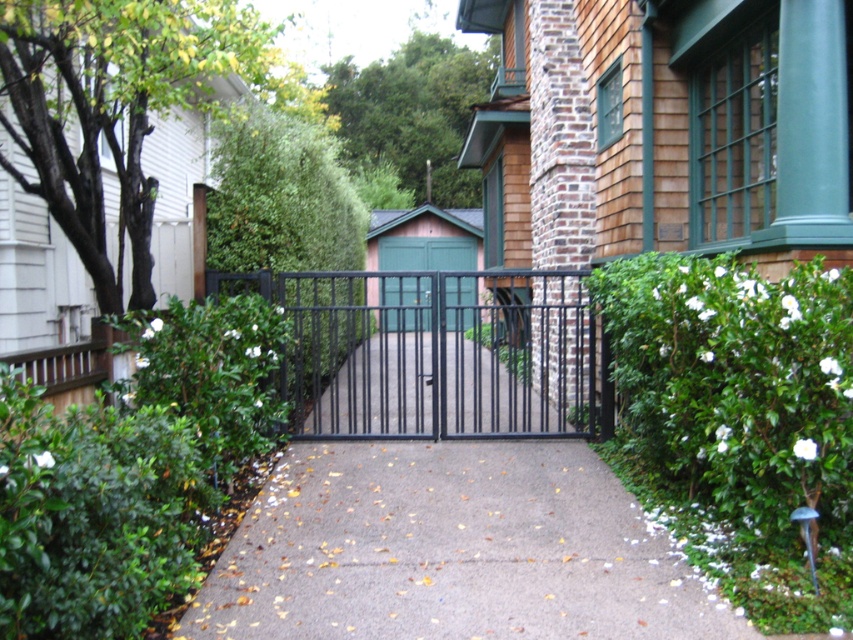
You are a delivery person approaching the entrance. You need to determine if you can see the green matte door at center over the green leafy hedge at right. Based on their heights, can you see the door?

The green leafy hedge at right is not as tall as the green matte door at center, so yes, you can see the green matte door at center over the green leafy hedge at right.

You are a delivery person approaching the entrance. You need to deliver a package to the house. The green leafy hedge at right and the green matte door at center are in your view. Which object is closer to the ground?

The green leafy hedge at right is located below the green matte door at center, so the hedge is closer to the ground.